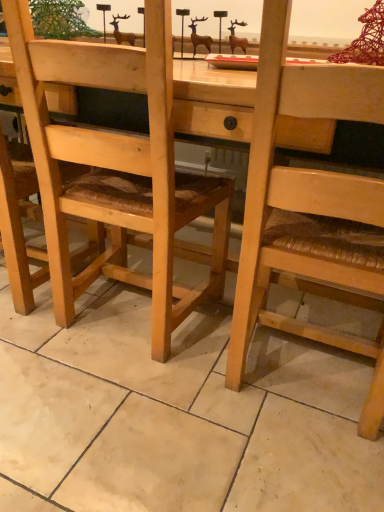
At what (x,y) coordinates should I click in order to perform the action: click on empty space that is to the right of wooden woven seat at center, placed as the second chair when sorted from right to left. Please return your answer as a coordinate pair (x, y). The width and height of the screenshot is (384, 512). Looking at the image, I should click on (103, 316).